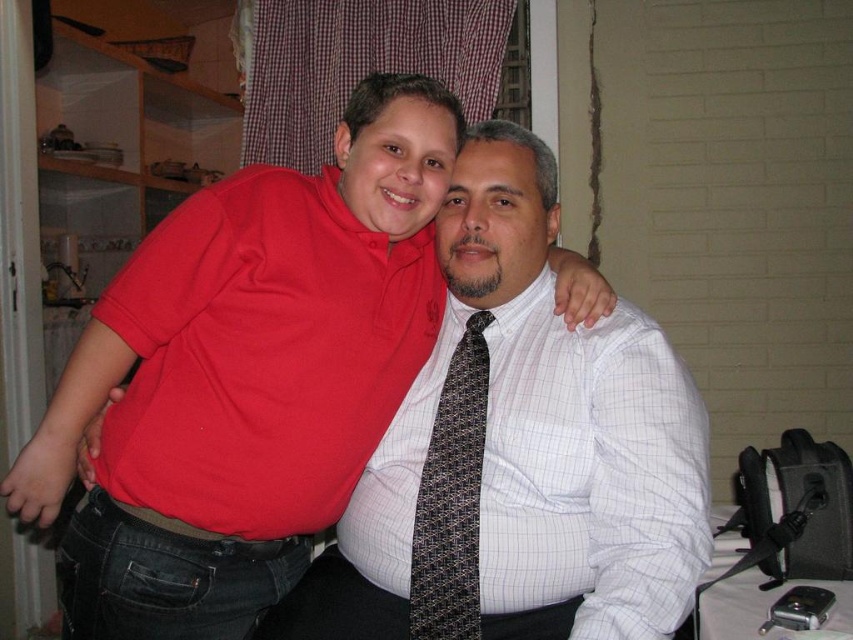
Question: Which of these objects is positioned closest to the matte white shirt at center?

Choices:
 (A) black textured tie at center
 (B) white checkered dress shirt at center

Answer: (A)

Question: Is white checkered dress shirt at center behind black textured tie at center?

Choices:
 (A) yes
 (B) no

Answer: (B)

Question: Which point is closer to the camera?

Choices:
 (A) (241, 483)
 (B) (444, 561)

Answer: (A)

Question: Which of the following is the farthest from the observer?

Choices:
 (A) (418, 609)
 (B) (270, 408)
 (C) (653, 616)

Answer: (A)

Question: Can you confirm if matte white shirt at center is bigger than black textured tie at center?

Choices:
 (A) yes
 (B) no

Answer: (A)

Question: Can you confirm if matte white shirt at center is bigger than white checkered dress shirt at center?

Choices:
 (A) yes
 (B) no

Answer: (A)